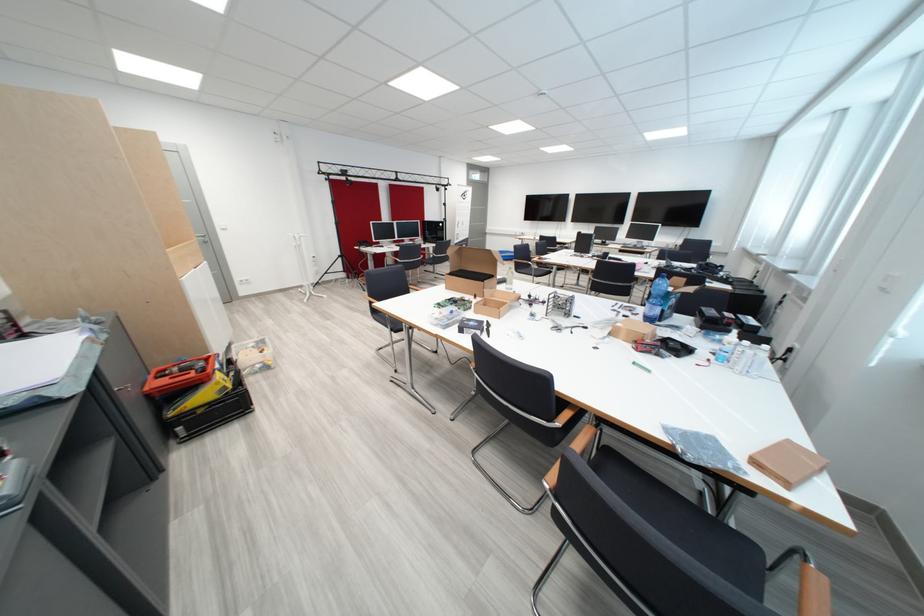
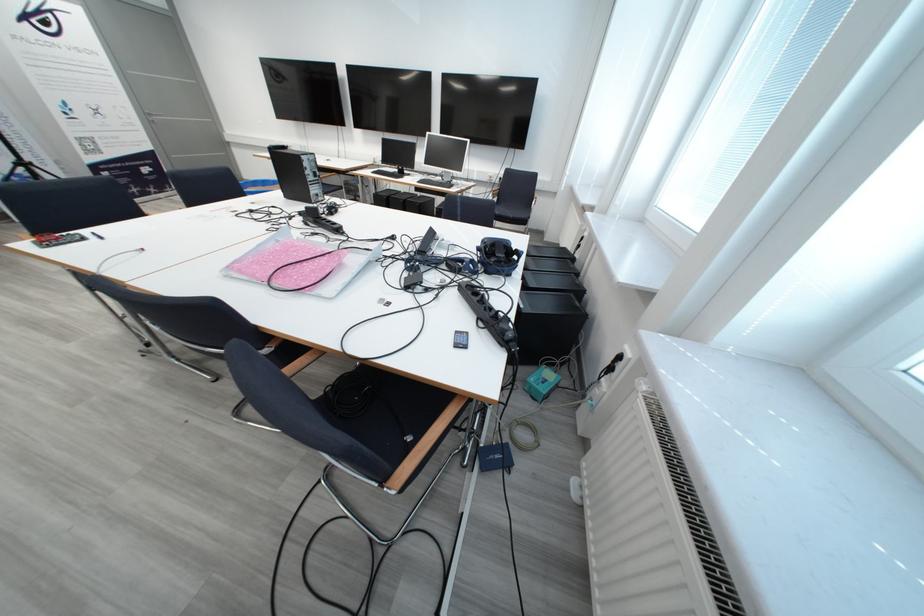
In a continuous first-person perspective shot, in which direction is the camera moving?

The cameraman walked toward right, forward.